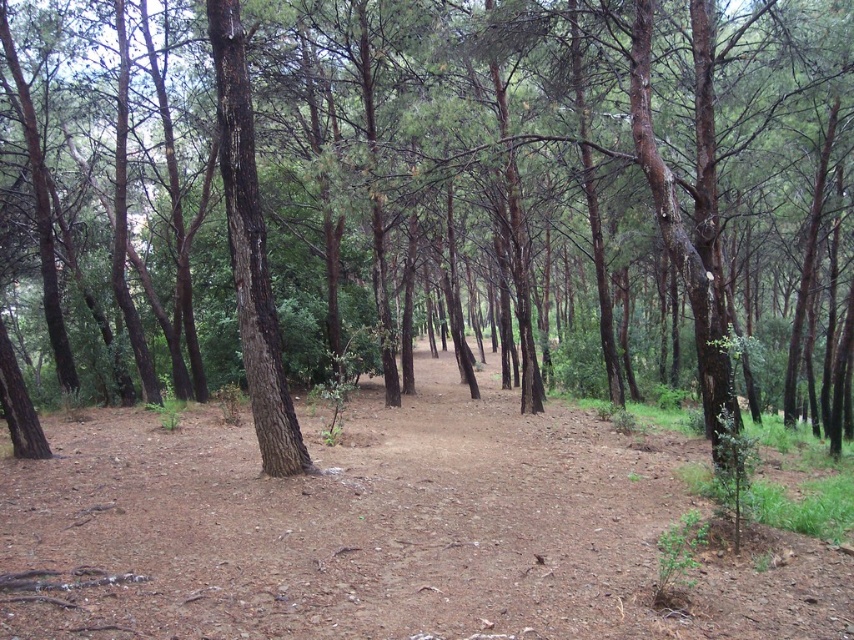
You are standing in the forest and want to walk from point A to point B. If point A is at point (632, 477) and point B is at point (238, 304), which direction should you head to move from A to B?

Since point A at (632, 477) is further to the camera than point B at (238, 304), you should move towards the direction of the camera to go from A to B.

You are a hiker trying to find your way through the forest. You notice a brown dirt track at center and a dark brown bark tree at center. Which one is wider?

The brown dirt track at center is bigger than the dark brown bark tree at center, so the brown dirt track at center is wider.

You are navigating through the forest and come across the brown dirt track at center. If you were to place a marker at coordinate point 0.831, 0.456, would it align with the track?

Yes, the marker at coordinate point (389, 531) would align with the brown dirt track at center since that is its exact position according to the description.